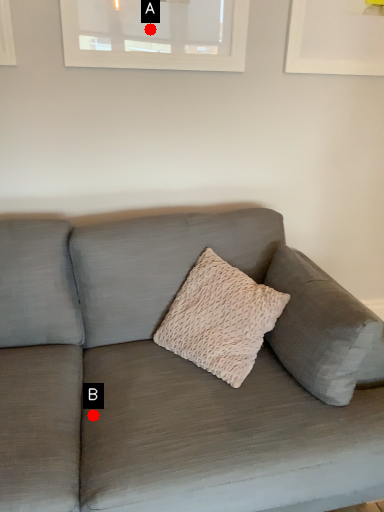
Question: Two points are circled on the image, labeled by A and B beside each circle. Which point is closer to the camera?

Choices:
 (A) A is closer
 (B) B is closer

Answer: (B)